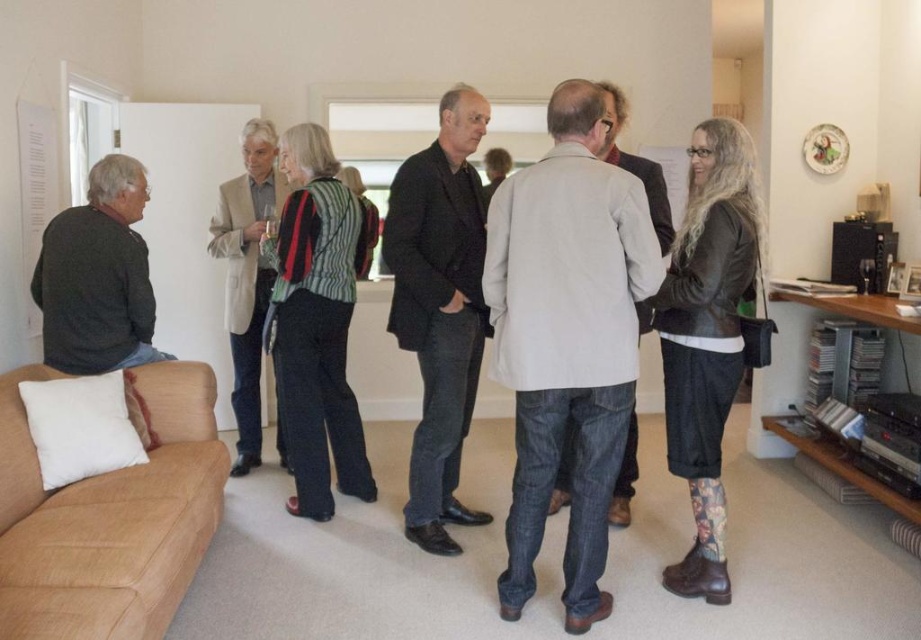
You are a delivery robot with a package that requires a 1.2 meter wide space to pass between two people. You are currently positioned between the black matte jacket at center and the light beige woolen blazer at center. Can you navigate through this space?

The distance between the black matte jacket at center and the light beige woolen blazer at center is 1.16 meters. Since the required space is 1.2 meters, the robot cannot pass through the gap as it is narrower than needed.

In the living room scene, there are two people wearing dark gray sweater at left and light beige woolen blazer at center. Which one is positioned more to the left?

dark gray sweater at left is positioned to the left of light beige woolen blazer at center.